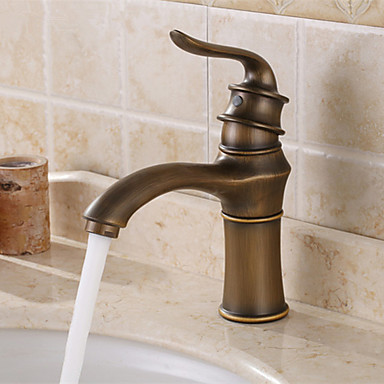
The height and width of the screenshot is (384, 384). Find the location of `sink`. sink is located at coordinates (38, 363).